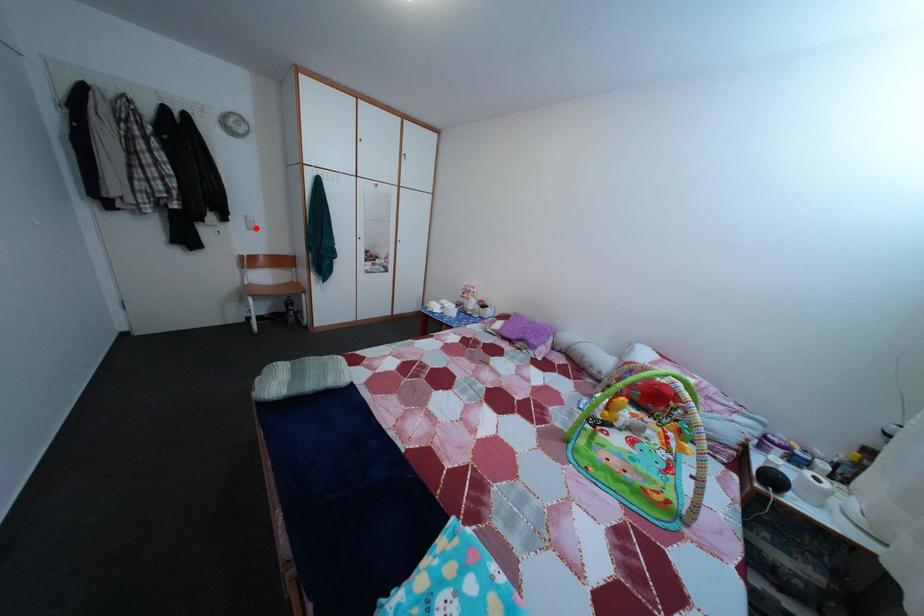
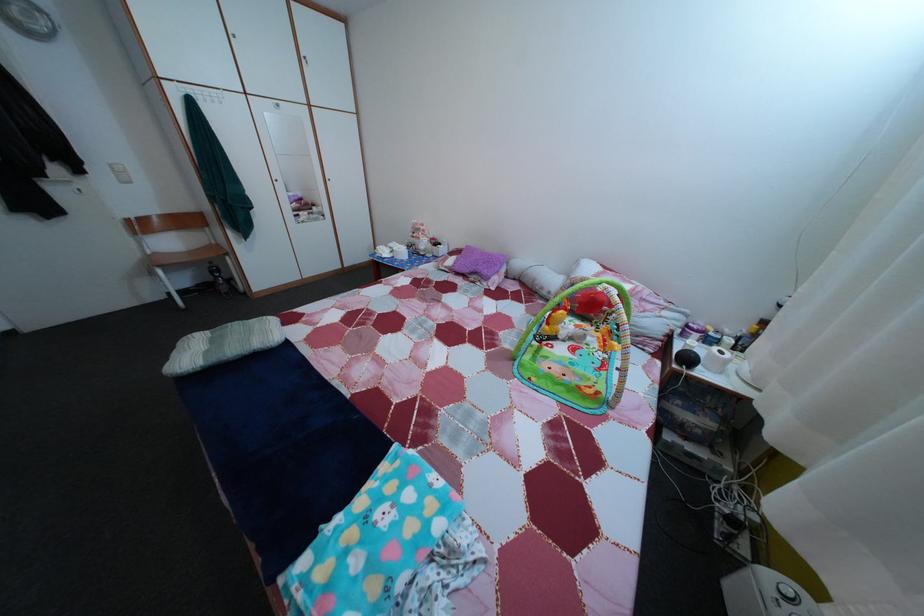
Where in the second image is the point corresponding to the highlighted location from the first image?

(123, 177)